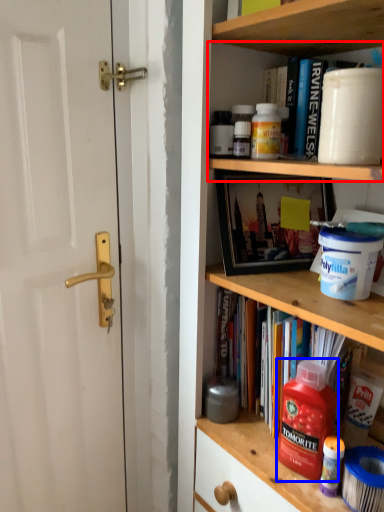
Question: Which of the following is the farthest to the observer, cabinet (highlighted by a red box) or cleaning product (highlighted by a blue box)?

Choices:
 (A) cabinet
 (B) cleaning product

Answer: (A)